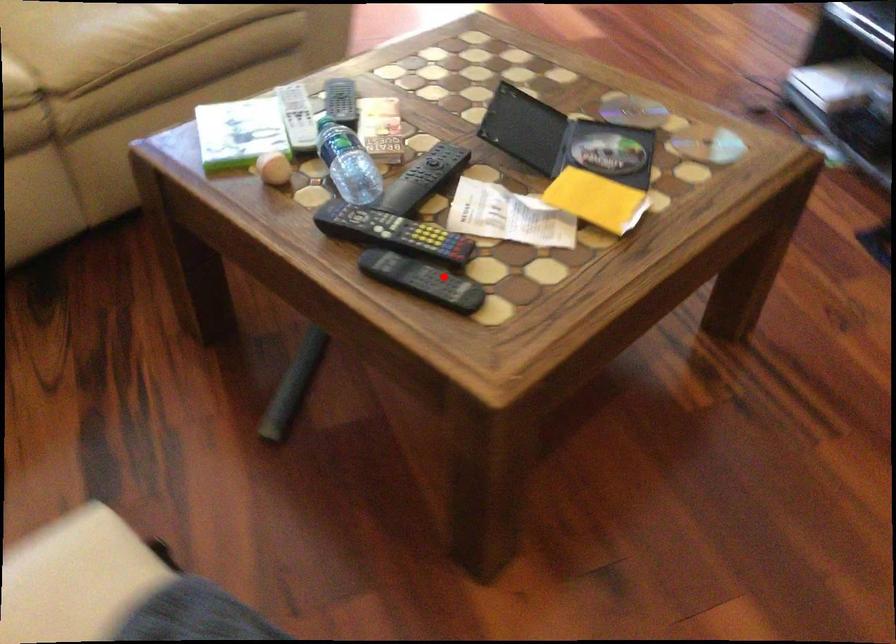
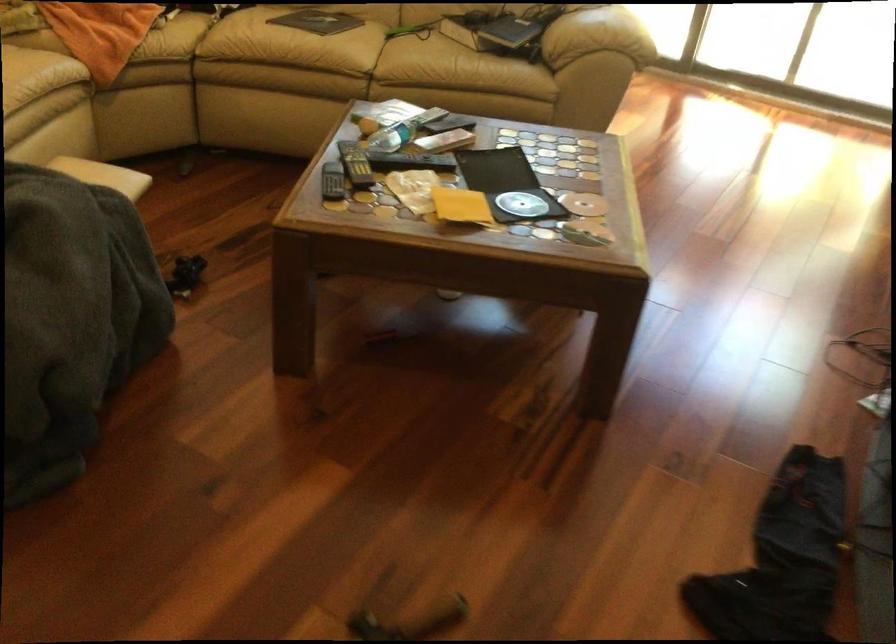
Question: I am providing you with two images of the same scene from different viewpoints. Given a red point in image1, look at the same physical point in image2. Is it:

Choices:
 (A) Closer to the viewpoint
 (B) Farther from the viewpoint

Answer: (B)